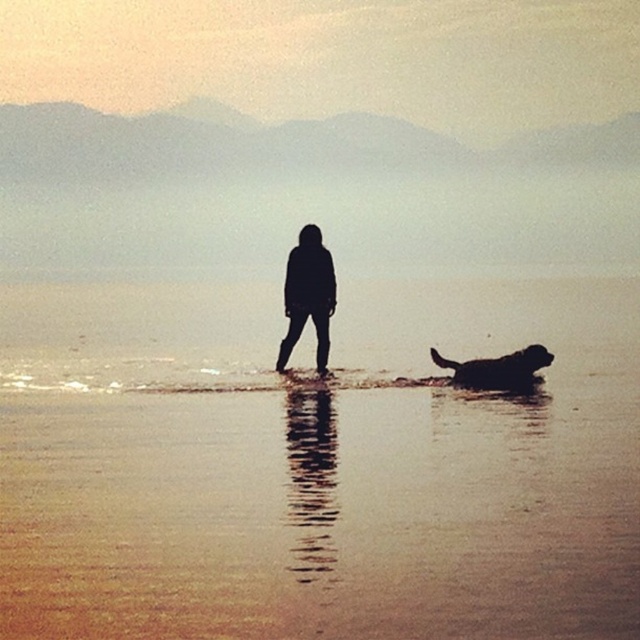
Does smooth sand water at center appear under black matte figure at center?

Correct, smooth sand water at center is located below black matte figure at center.

Which is in front, point (541, 493) or point (300, 330)?

Point (541, 493) is more forward.

Who is more distant from viewer, [92,372] or [333,298]?

The point [92,372] is more distant.

Image resolution: width=640 pixels, height=640 pixels. I want to click on smooth sand water at center, so click(x=316, y=465).

Between smooth sand water at center and black matte dog at lower right, which one appears on the left side from the viewer's perspective?

Positioned to the left is smooth sand water at center.

Between smooth sand water at center and black matte dog at lower right, which one is positioned lower?

Positioned lower is black matte dog at lower right.

This screenshot has height=640, width=640. I want to click on smooth sand water at center, so click(x=316, y=465).

Can you confirm if black matte figure at center is positioned to the right of black matte dog at lower right?

Incorrect, black matte figure at center is not on the right side of black matte dog at lower right.

Between black matte figure at center and black matte dog at lower right, which one is positioned higher?

black matte figure at center is above.

The height and width of the screenshot is (640, 640). What do you see at coordinates (308, 296) in the screenshot?
I see `black matte figure at center` at bounding box center [308, 296].

In order to click on black matte figure at center in this screenshot , I will do `click(308, 296)`.